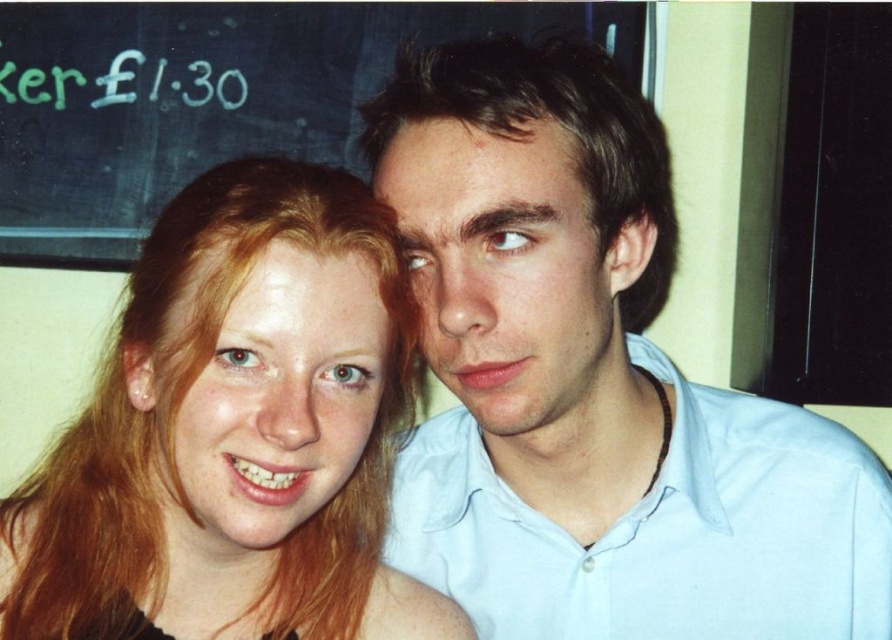
You are holding a 24 inch ruler and want to measure the distance from your eyes to the point at coordinates point (147, 388) in the image. Based on the information provided, will your ruler be long enough to reach that point?

The distance of point (147, 388) from viewer is 26.45 inches, so the ruler is 24 inches and cannot reach the point.